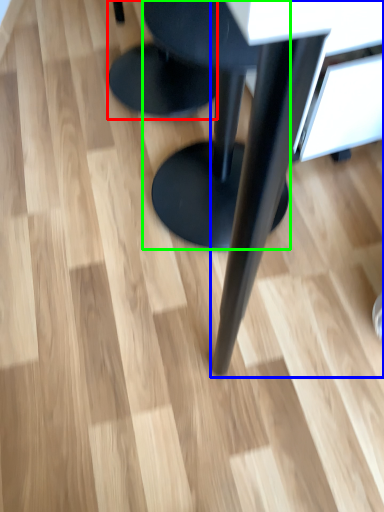
Question: Which object is the closest to the stool (highlighted by a red box)? Choose among these: table (highlighted by a blue box) or stool (highlighted by a green box).

Choices:
 (A) table
 (B) stool

Answer: (B)